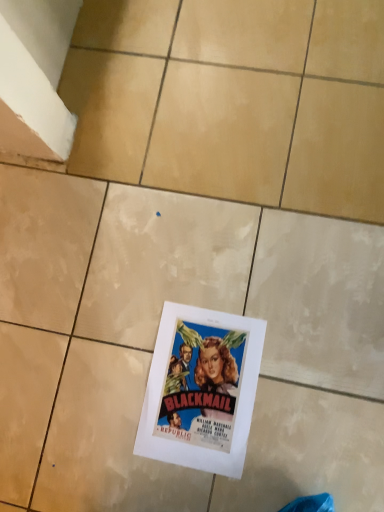
The width and height of the screenshot is (384, 512). Describe the element at coordinates (201, 389) in the screenshot. I see `matte paper poster at center` at that location.

At what (x,y) coordinates should I click in order to perform the action: click on matte paper poster at center. Please return your answer as a coordinate pair (x, y). The width and height of the screenshot is (384, 512). Looking at the image, I should click on (201, 389).

Find the location of a particular element. matte paper poster at center is located at coordinates (201, 389).